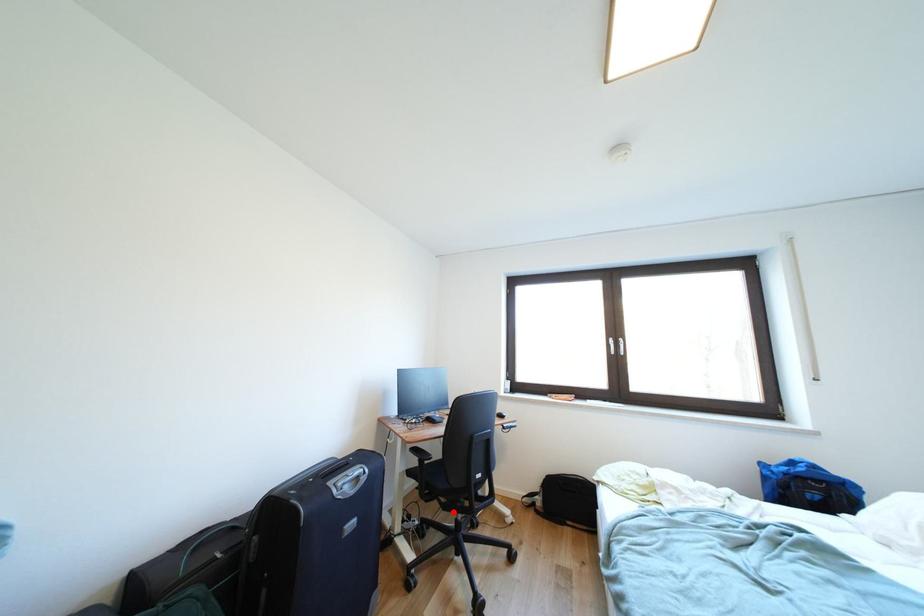
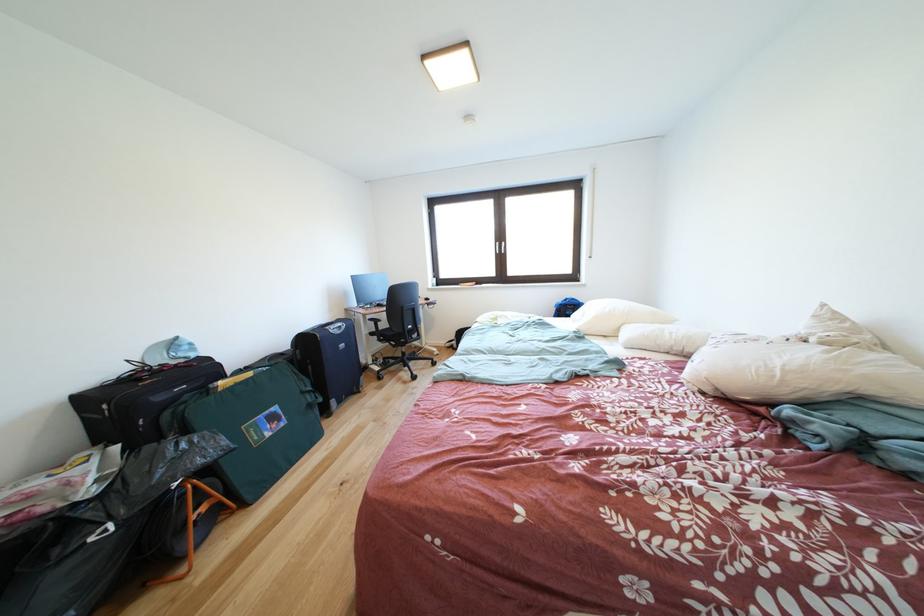
Question: I am providing you with two images of the same scene from different viewpoints. Given a red point in image1, look at the same physical point in image2. Is it:

Choices:
 (A) Closer to the viewpoint
 (B) Farther from the viewpoint

Answer: (A)